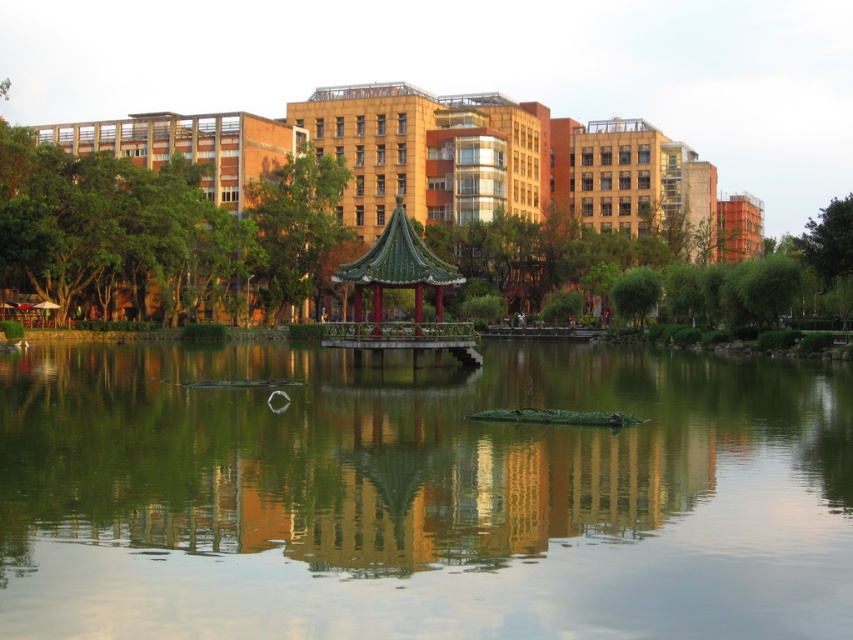
You are standing on the wooden bridge leading to the pavilion. You want to take a photo of the green reflective water at center. Where should you position yourself to capture it in the frame?

The green reflective water at center is located at point [421,497]. To capture it in your photo, position yourself at that coordinate while on the wooden bridge.

You are a park visitor who wants to take a photo of the green glazed tile gazebo at center from the wooden bridge. However, you notice the green reflective water at center might block your view. Can you still see the gazebo clearly?

The green reflective water at center is wider than the green glazed tile gazebo at center, so it might block the view. However, since the gazebo is on an island connected by the bridge, you can position yourself on the bridge where the water doesn

You are standing on the wooden bridge leading to the pavilion in the urban park. You notice a point marked at coordinates (x=421, y=497). Which object does this point correspond to?

The point at coordinates (x=421, y=497) corresponds to the green reflective water at center.